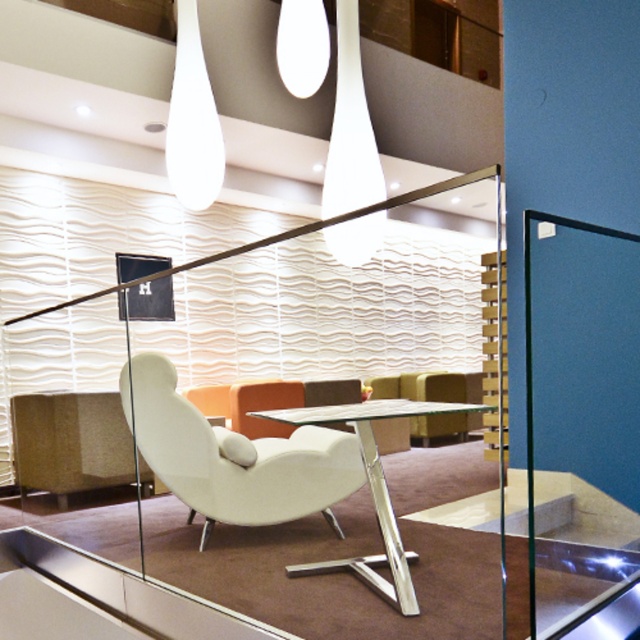
Question: Which point is farther from the camera taking this photo?

Choices:
 (A) (324, 429)
 (B) (563, 548)
 (C) (342, 134)
 (D) (380, 532)

Answer: (C)

Question: Which point appears closest to the camera in this image?

Choices:
 (A) (349, 132)
 (B) (170, 433)
 (C) (390, 509)

Answer: (C)

Question: Among these objects, which one is farthest from the camera?

Choices:
 (A) white matte swivel chair at center
 (B) transparent glass door at right

Answer: (A)

Question: Is white matte swivel chair at center to the right of transparent glass table at center from the viewer's perspective?

Choices:
 (A) yes
 (B) no

Answer: (B)

Question: Is white matte swivel chair at center behind transparent glass table at center?

Choices:
 (A) yes
 (B) no

Answer: (A)

Question: Is transparent glass door at right positioned behind transparent glass table at center?

Choices:
 (A) no
 (B) yes

Answer: (A)